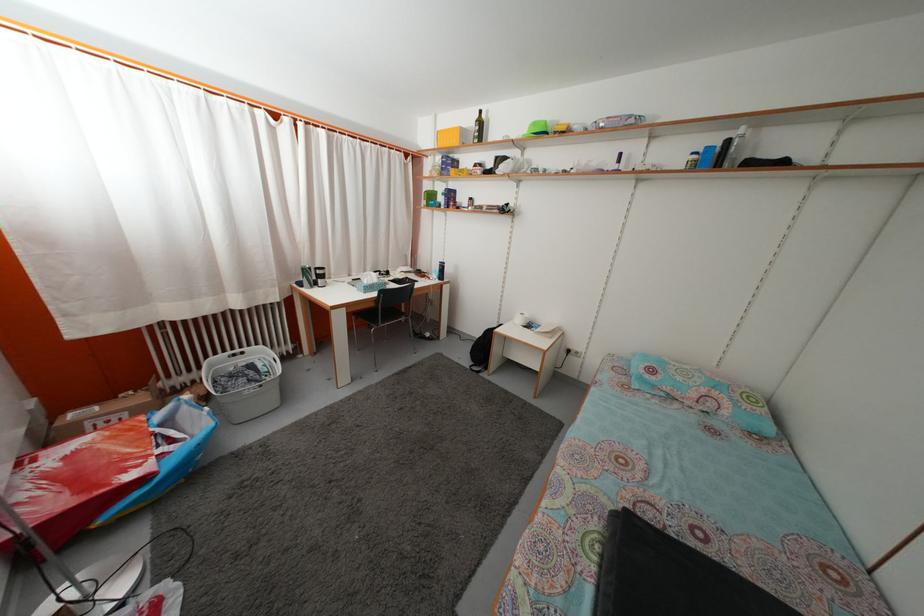
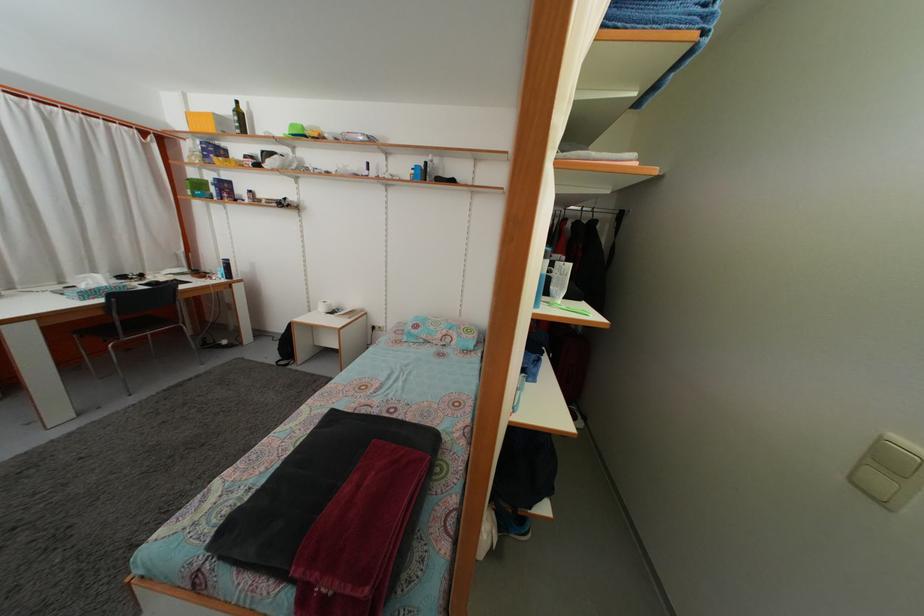
The point at (485, 131) is marked in the first image. Where is the corresponding point in the second image?

(246, 122)